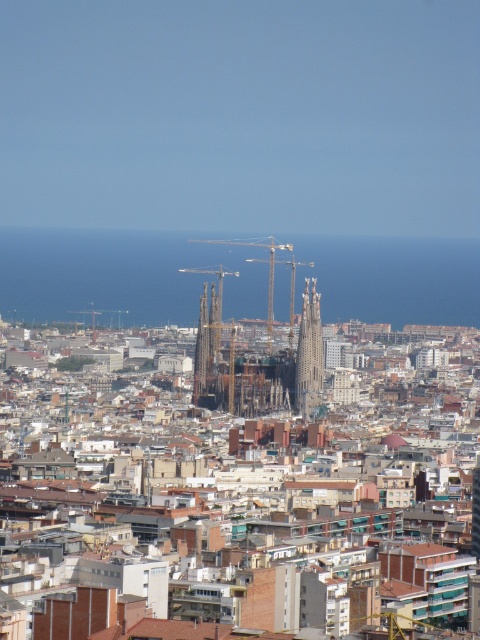
Question: Which point is closer to the camera taking this photo?

Choices:
 (A) (231, 365)
 (B) (314, 317)

Answer: (A)

Question: Does gray stone tower at center come behind dark brown stone tower at center?

Choices:
 (A) no
 (B) yes

Answer: (B)

Question: Does gray stone tower at center have a larger size compared to dark brown stone tower at center?

Choices:
 (A) yes
 (B) no

Answer: (B)

Question: Which object is farther from the camera taking this photo?

Choices:
 (A) gray stone tower at center
 (B) dark brown stone tower at center

Answer: (A)

Question: Can you confirm if gray stone tower at center is bigger than dark brown stone tower at center?

Choices:
 (A) no
 (B) yes

Answer: (A)